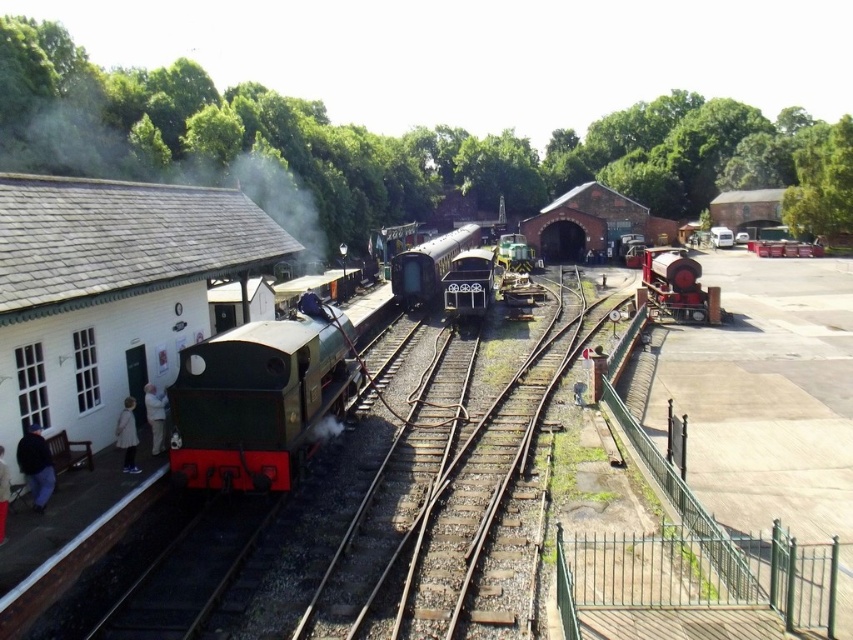
Question: Does polished dark green train at center have a lesser width compared to blue fabric cap at center?

Choices:
 (A) no
 (B) yes

Answer: (A)

Question: Which is nearer to the dark blue jacket at lower left?

Choices:
 (A) polished dark green train at center
 (B) white fabric jacket at lower left

Answer: (B)

Question: Can you confirm if gray slate roof at upper left is smaller than blue fabric cap at center?

Choices:
 (A) yes
 (B) no

Answer: (B)

Question: Is light gray fabric jacket at lower left bigger than blue fabric cap at center?

Choices:
 (A) no
 (B) yes

Answer: (A)

Question: Which of the following is the farthest from the observer?

Choices:
 (A) light gray fabric jacket at lower left
 (B) green polished wood train at left

Answer: (A)

Question: Which point is closer to the camera taking this photo?

Choices:
 (A) (126, 432)
 (B) (35, 493)

Answer: (B)